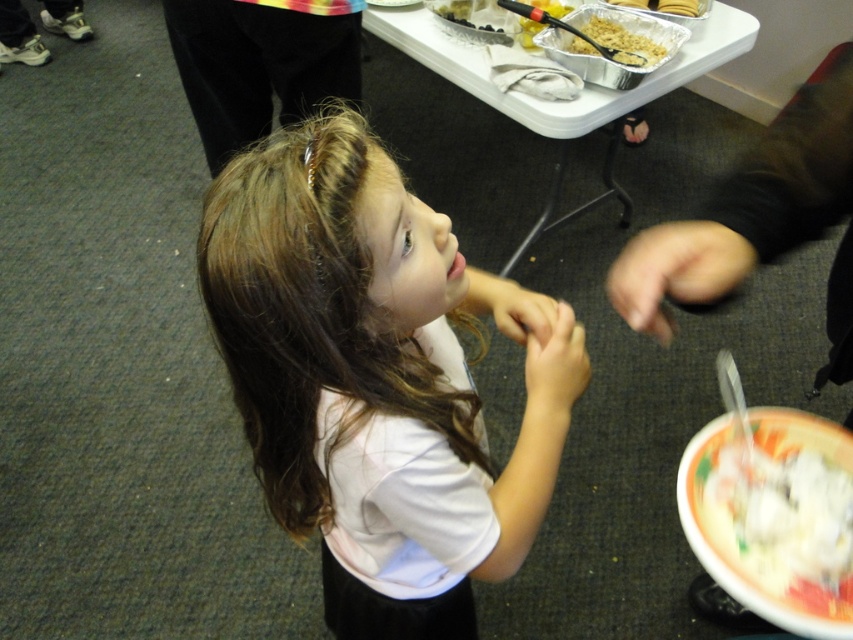
You are standing in the room where the young girl is talking. You want to reach the point marked at coordinates (277, 518). Is this point within arm reach from your current position?

The point marked at coordinates (277, 518) is 1.01 meters away from the viewer, which is slightly beyond typical arm reach. You would need to take a step forward to reach it.

You are at a party and want to grab a spoon to eat the food. The metallic aluminum foil tray at upper center and the shiny plastic spoon at upper center are both on the table. Where is the spoon located relative to the tray?

The shiny plastic spoon at upper center is above the metallic aluminum foil tray at upper center.